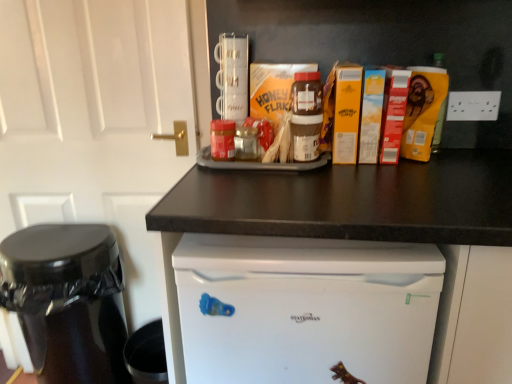
Question: Is shiny black coffee maker at left taller than white plastic electric outlet at upper right?

Choices:
 (A) no
 (B) yes

Answer: (B)

Question: Can you see shiny black coffee maker at left touching white plastic electric outlet at upper right?

Choices:
 (A) no
 (B) yes

Answer: (A)

Question: Is shiny black coffee maker at left at the left side of white plastic electric outlet at upper right?

Choices:
 (A) yes
 (B) no

Answer: (A)

Question: Considering the relative sizes of shiny black coffee maker at left and white plastic electric outlet at upper right in the image provided, is shiny black coffee maker at left bigger than white plastic electric outlet at upper right?

Choices:
 (A) yes
 (B) no

Answer: (A)

Question: Is shiny black coffee maker at left aimed at white plastic electric outlet at upper right?

Choices:
 (A) yes
 (B) no

Answer: (B)

Question: Considering the positions of white plastic electric outlet at upper right and white matte door at upper left in the image, is white plastic electric outlet at upper right taller or shorter than white matte door at upper left?

Choices:
 (A) tall
 (B) short

Answer: (B)

Question: Is white plastic electric outlet at upper right spatially inside white matte door at upper left, or outside of it?

Choices:
 (A) outside
 (B) inside

Answer: (A)

Question: Is white plastic electric outlet at upper right to the left or to the right of white matte door at upper left in the image?

Choices:
 (A) left
 (B) right

Answer: (B)

Question: Considering the positions of point (474, 99) and point (9, 195), is point (474, 99) closer or farther from the camera than point (9, 195)?

Choices:
 (A) closer
 (B) farther

Answer: (A)

Question: Considering the relative positions of white matte door at upper left and white plastic electric outlet at upper right in the image provided, is white matte door at upper left to the left or to the right of white plastic electric outlet at upper right?

Choices:
 (A) right
 (B) left

Answer: (B)

Question: Is white matte door at upper left taller or shorter than white plastic electric outlet at upper right?

Choices:
 (A) tall
 (B) short

Answer: (A)

Question: Does point (56, 139) appear closer or farther from the camera than point (460, 109)?

Choices:
 (A) farther
 (B) closer

Answer: (A)

Question: Relative to white plastic electric outlet at upper right, is white matte door at upper left in front or behind?

Choices:
 (A) front
 (B) behind

Answer: (A)

Question: From a real-world perspective, is white plastic electric outlet at upper right physically located above or below shiny black coffee maker at left?

Choices:
 (A) above
 (B) below

Answer: (A)

Question: Does point (493, 99) appear closer or farther from the camera than point (84, 248)?

Choices:
 (A) closer
 (B) farther

Answer: (A)